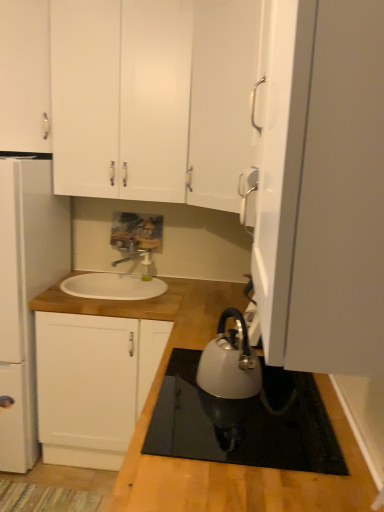
Identify the location of space that is in front of satin silver kettle at lower center. (234, 424).